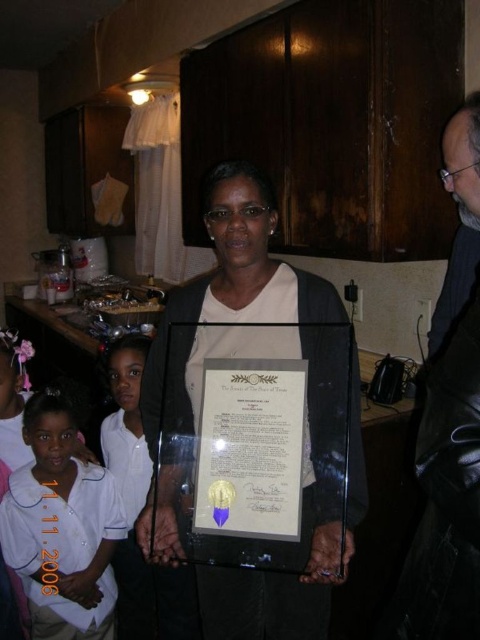
You are a painter who needs to paint the matte black frame at center. If your paintbrush has a 1 meter reach, can you paint it without moving closer?

The matte black frame at center is 1.10 meters away from the camera. Since your paintbrush only reaches 1 meter, you cannot paint it without moving closer.

You are organizing a gallery wall and need to place the matte black frame at center and the matte gold certificate at center. According to the image, which object should be placed on the right side of the wall?

The matte gold certificate at center should be placed on the right side of the wall because in the image, the matte black frame at center is positioned to its left.

Based on the photo, you are trying to hang a picture on the wall between the matte black frame at center and the white cotton shirt at lower left. Which object should you avoid placing the hook near to ensure it doesn

You should avoid placing the hook near the white cotton shirt at lower left because the matte black frame at center might be wider than the white cotton shirt at lower left, so the shirt is narrower and less likely to block the hook.